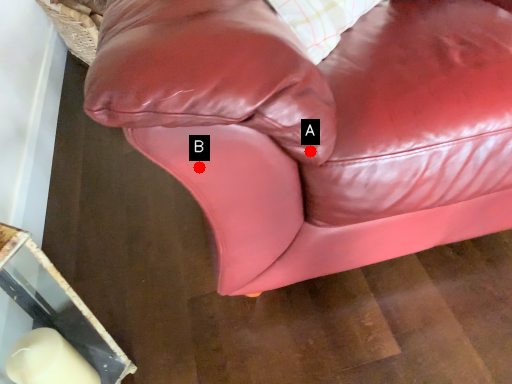
Question: Two points are circled on the image, labeled by A and B beside each circle. Which point is farther from the camera taking this photo?

Choices:
 (A) A is further
 (B) B is further

Answer: (B)